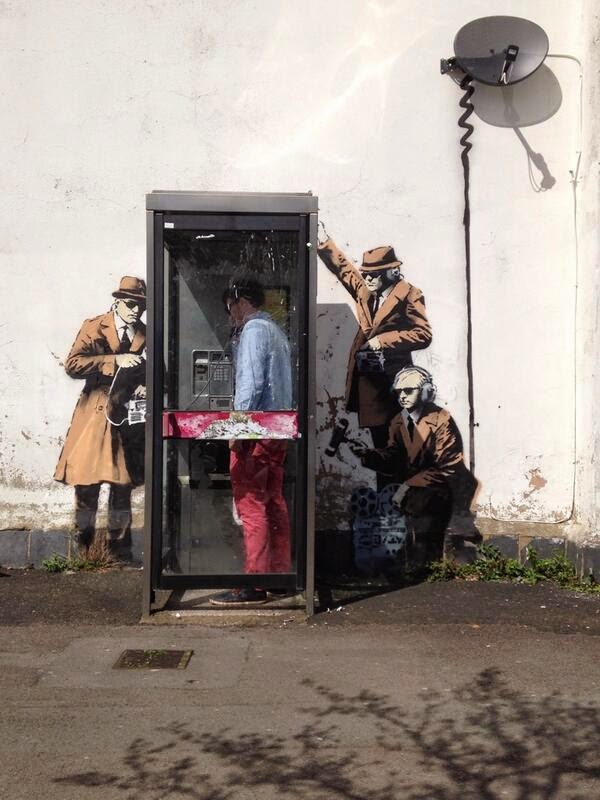
At what (x,y) coordinates should I click in order to perform the action: click on mural. Please return your answer as a coordinate pair (x, y). The image size is (600, 800). Looking at the image, I should click on 118,354, 452,498, 394,310.